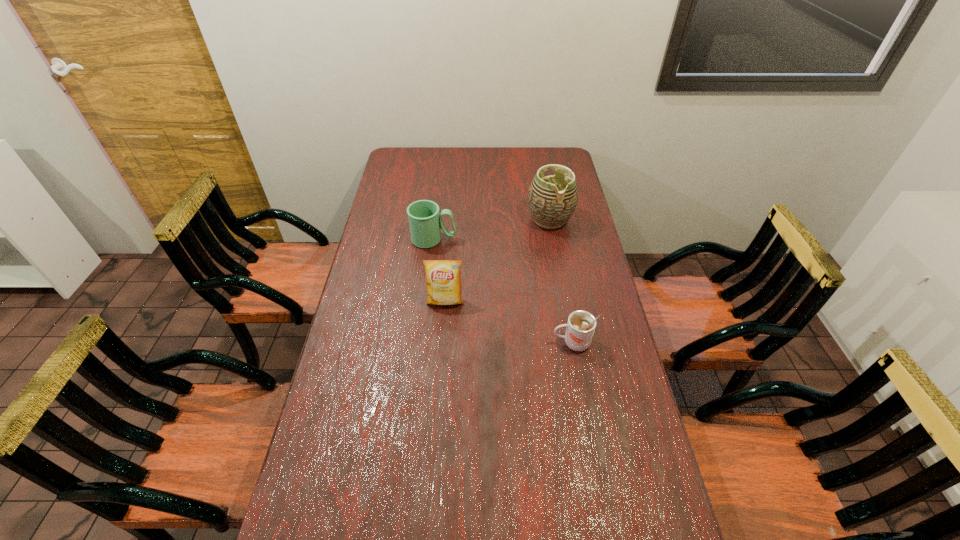
Identify which object is located as the second nearest to the mug. Please provide its 2D coordinates. Your answer should be formatted as a tuple, i.e. [(x, y)], where the tuple contains the x and y coordinates of a point satisfying the conditions above.

[(552, 200)]